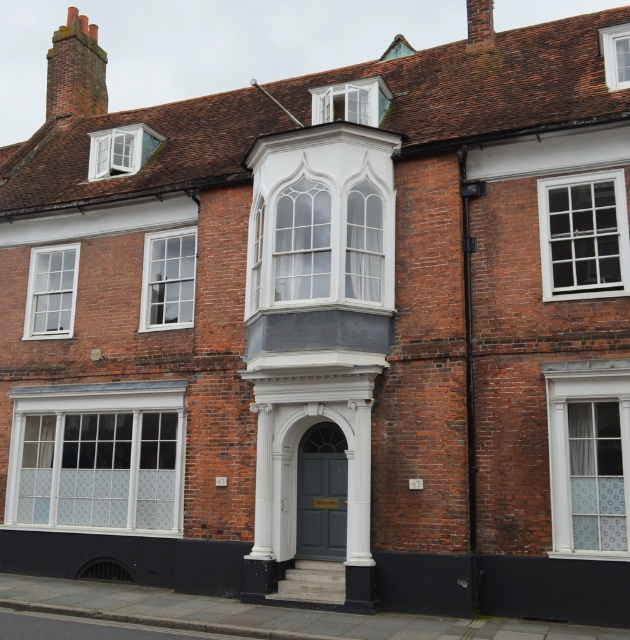
From the picture: You are an architect evaluating the symmetry of this traditional brick building. You notice the white glass window at center and the matte white bay window at upper center. Which of these two windows has a larger size?

The matte white bay window at upper center is larger in size compared to the white glass window at center, as stated in the description.

You are an architect examining the traditional brick building. You notice the satin glass window at center and the matte white bay window at upper center. Which of these two windows is located to the right of the other?

The satin glass window at center is positioned on the right side of the matte white bay window at upper center.

You are a visitor standing in front of the traditional brick building. You notice a point marked at coordinates (168, 280). Based on the scene description, what object is located at that point?

The point at coordinates (168, 280) marks the location of the white glass window at center.